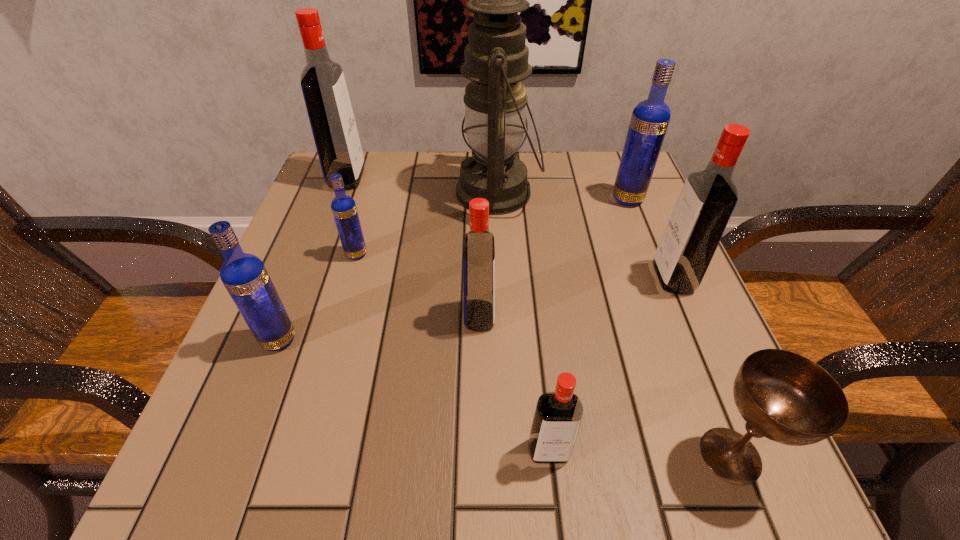
Image resolution: width=960 pixels, height=540 pixels. In order to click on object identified as the third closest to the second biggest red vodka in this screenshot , I will do `click(783, 396)`.

Select which vodka appears as the fourth closest to the second nearest blue vodka. Please provide its 2D coordinates. Your answer should be formatted as a tuple, i.e. [(x, y)], where the tuple contains the x and y coordinates of a point satisfying the conditions above.

[(558, 415)]

The width and height of the screenshot is (960, 540). I want to click on vodka that is the second closest one to the leftmost blue vodka, so click(479, 248).

Select which red vodka appears as the second closest to the third smallest red vodka. Please provide its 2D coordinates. Your answer should be formatted as a tuple, i.e. [(x, y)], where the tuple contains the x and y coordinates of a point satisfying the conditions above.

[(558, 415)]

The width and height of the screenshot is (960, 540). In order to click on the second closest red vodka to the tallest vodka in this screenshot , I will do `click(707, 200)`.

Identify which blue vodka is the second nearest to the farthest blue vodka. Please provide its 2D coordinates. Your answer should be formatted as a tuple, i.e. [(x, y)], where the tuple contains the x and y coordinates of a point satisfying the conditions above.

[(244, 275)]

Point out which blue vodka is positioned as the second nearest to the second farthest red vodka. Please provide its 2D coordinates. Your answer should be formatted as a tuple, i.e. [(x, y)], where the tuple contains the x and y coordinates of a point satisfying the conditions above.

[(344, 209)]

Identify the location of vacant space that satisfies the following two spatial constraints: 1. on the front and back of the chalice; 2. on the right side of the farthest red vodka. (245, 455).

Where is `vacant space that satisfies the following two spatial constraints: 1. on the back side of the rightmost blue vodka; 2. on the right side of the smallest blue vodka`? vacant space that satisfies the following two spatial constraints: 1. on the back side of the rightmost blue vodka; 2. on the right side of the smallest blue vodka is located at coordinates (372, 199).

The image size is (960, 540). I want to click on free spot that satisfies the following two spatial constraints: 1. on the front side of the chalice; 2. on the left side of the oil lamp, so click(510, 455).